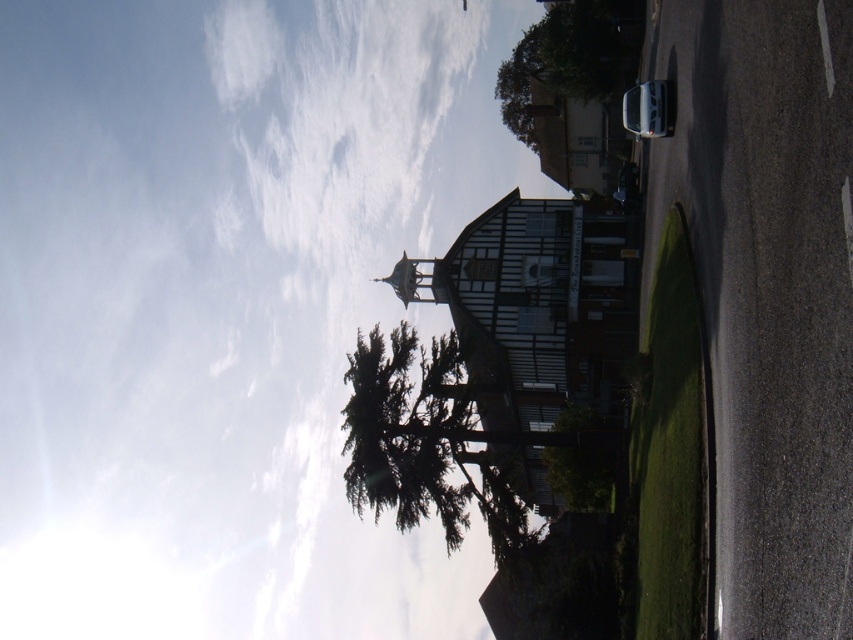
You are a visitor approaching the building and notice two trees in front of it. Which tree is closer to the building? The green textured tree at center or the green leafy tree at upper center?

The green textured tree at center is closer to the building because it is positioned under the green leafy tree at upper center, indicating it is in front of the latter.

You are standing in front of the building and want to take a photo that includes both the green textured tree at center and the green leafy tree at upper center. Which tree should you position to your left side in the frame to capture both in the shot?

To include both the green textured tree at center and the green leafy tree at upper center in the photo, position the green textured tree at center to your left side since it is already located to the left of the green leafy tree at upper center.